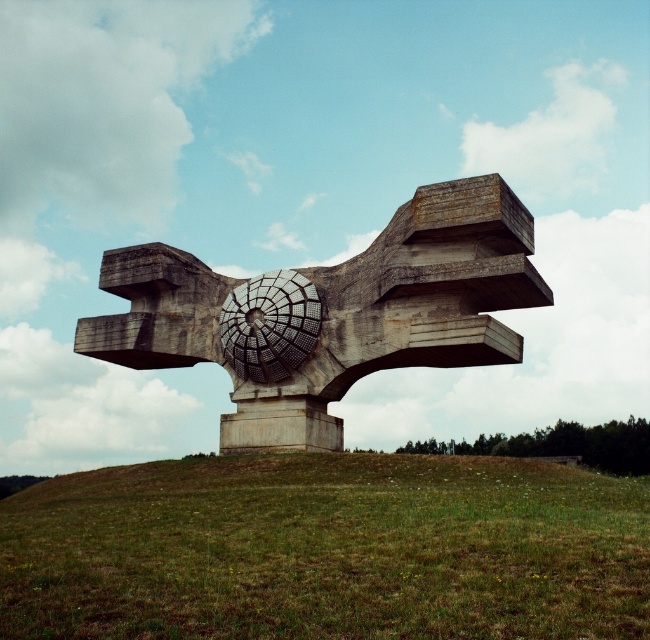
Question: Can you confirm if green grass at center is thinner than gray concrete sculpture at center?

Choices:
 (A) no
 (B) yes

Answer: (A)

Question: Which of the following is the farthest from the observer?

Choices:
 (A) green grass at center
 (B) gray concrete sculpture at center

Answer: (B)

Question: Does green grass at center appear on the right side of gray concrete sculpture at center?

Choices:
 (A) no
 (B) yes

Answer: (B)

Question: Which object is closer to the camera taking this photo?

Choices:
 (A) green grass at center
 (B) gray concrete sculpture at center

Answer: (A)

Question: Can you confirm if green grass at center is positioned to the left of gray concrete sculpture at center?

Choices:
 (A) yes
 (B) no

Answer: (B)

Question: Among these objects, which one is nearest to the camera?

Choices:
 (A) gray concrete sculpture at center
 (B) green grass at center

Answer: (B)